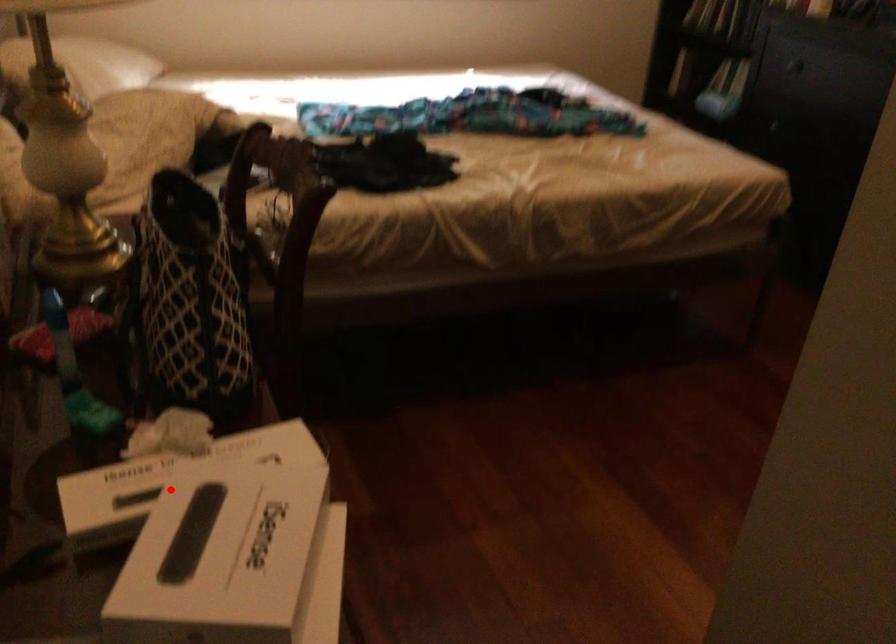
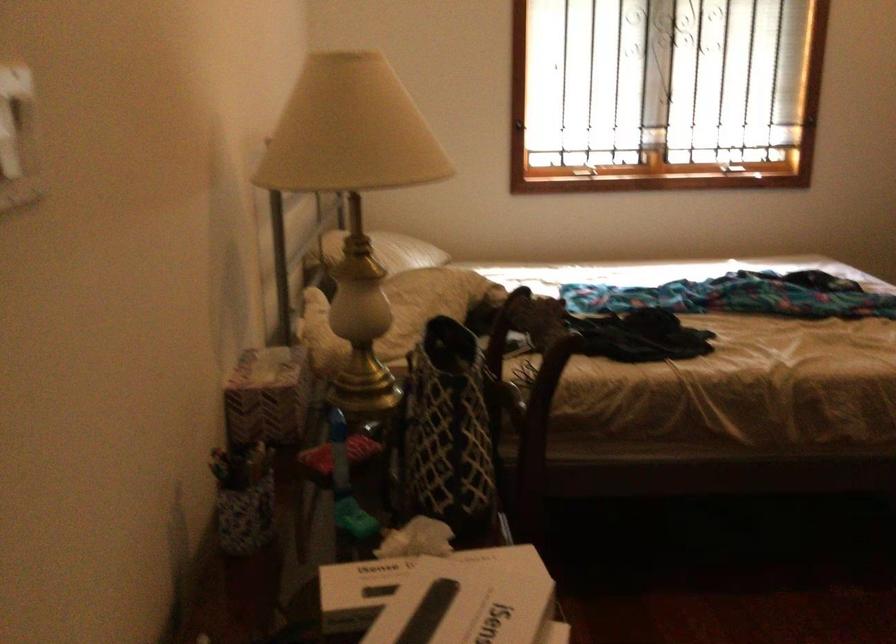
Question: I am providing you with two images of the same scene from different viewpoints. A red point is shown in image1. For the corresponding object point in image2, is it positioned nearer or farther from the camera?

Choices:
 (A) Nearer
 (B) Farther

Answer: (B)